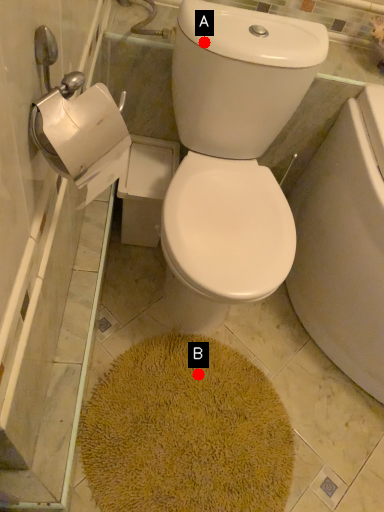
Question: Two points are circled on the image, labeled by A and B beside each circle. Which point is closer to the camera?

Choices:
 (A) A is closer
 (B) B is closer

Answer: (A)